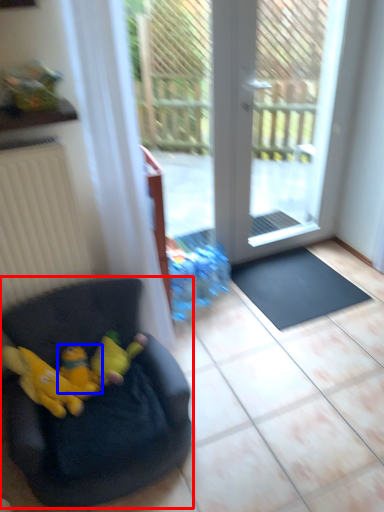
Question: Which object is further to the camera taking this photo, chair (highlighted by a red box) or toy (highlighted by a blue box)?

Choices:
 (A) chair
 (B) toy

Answer: (B)